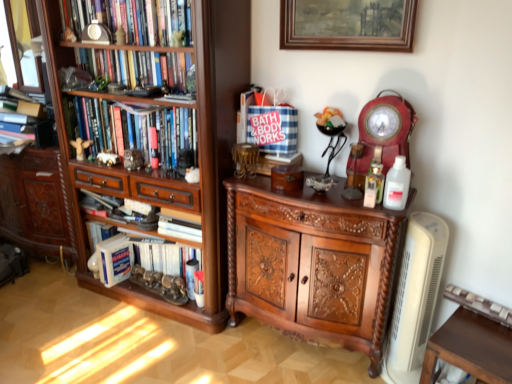
Image resolution: width=512 pixels, height=384 pixels. Find the location of `free space to the left of polished wood cabinet at center`. free space to the left of polished wood cabinet at center is located at coordinates (198, 356).